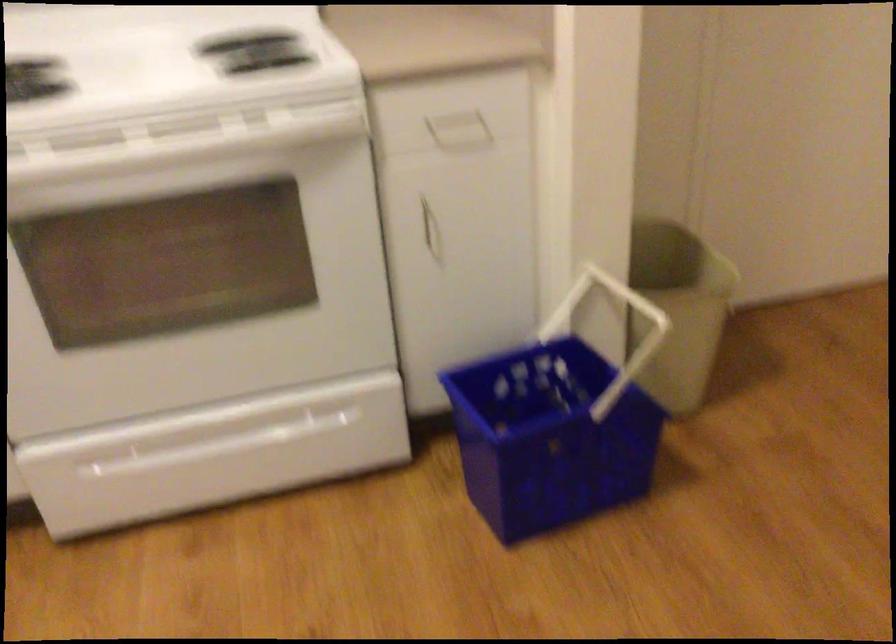
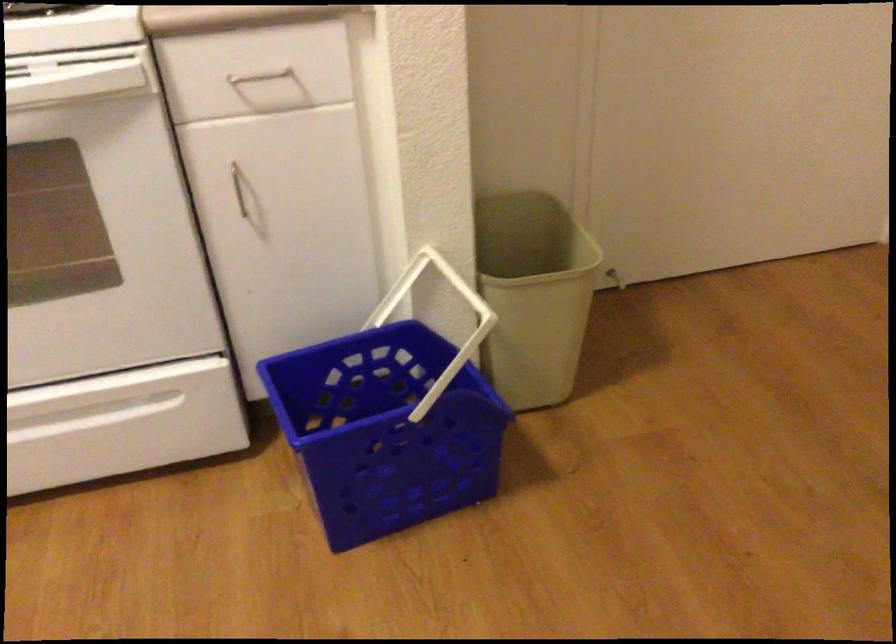
Question: Based on the continuous images, in which direction is the camera rotating? Reply with the corresponding letter.

Choices:
 (A) Left
 (B) Right
 (C) Up
 (D) Down

Answer: (D)